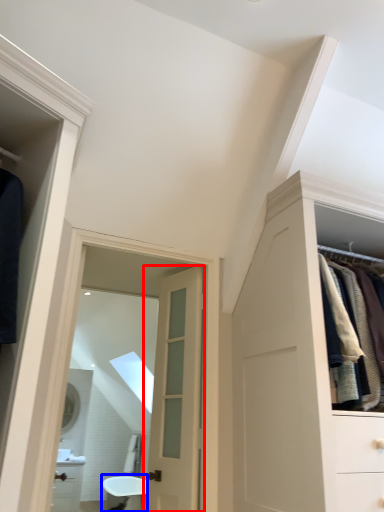
Question: Which object appears closest to the camera in this image, door (highlighted by a red box) or bath (highlighted by a blue box)?

Choices:
 (A) door
 (B) bath

Answer: (A)